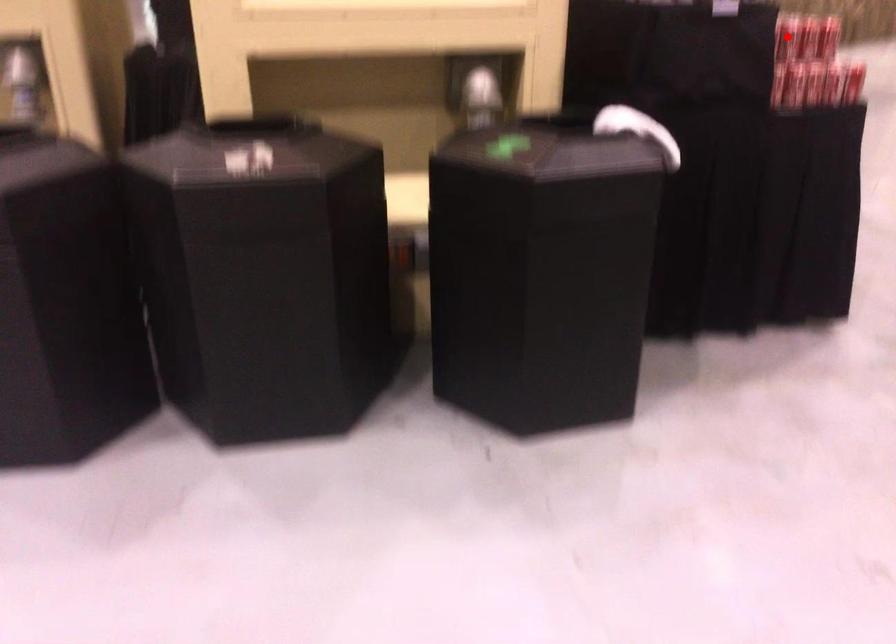
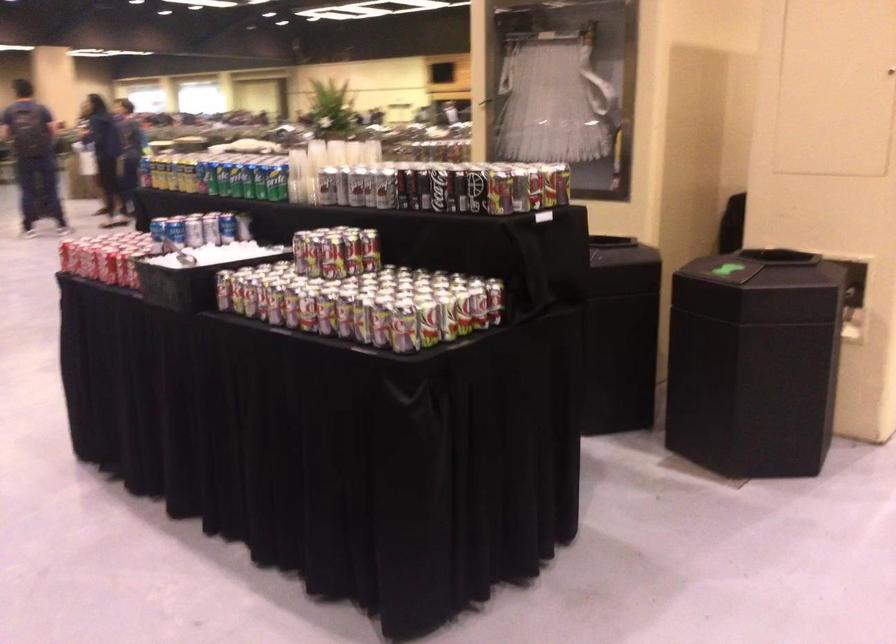
Question: I am providing you with two images of the same scene from different viewpoints. A red point is marked on the first image. Is the red point's position out of view in image 2?

Choices:
 (A) Yes
 (B) No

Answer: (A)